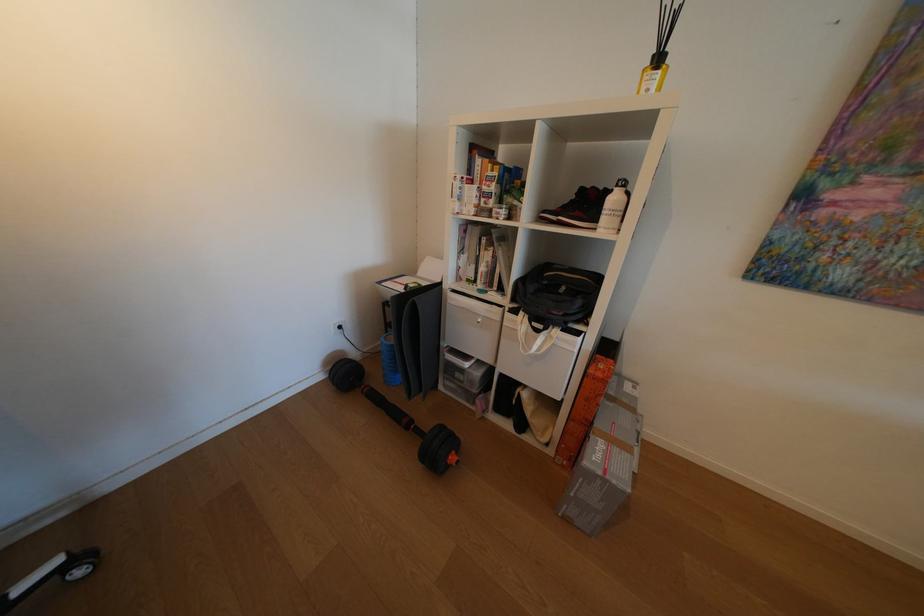
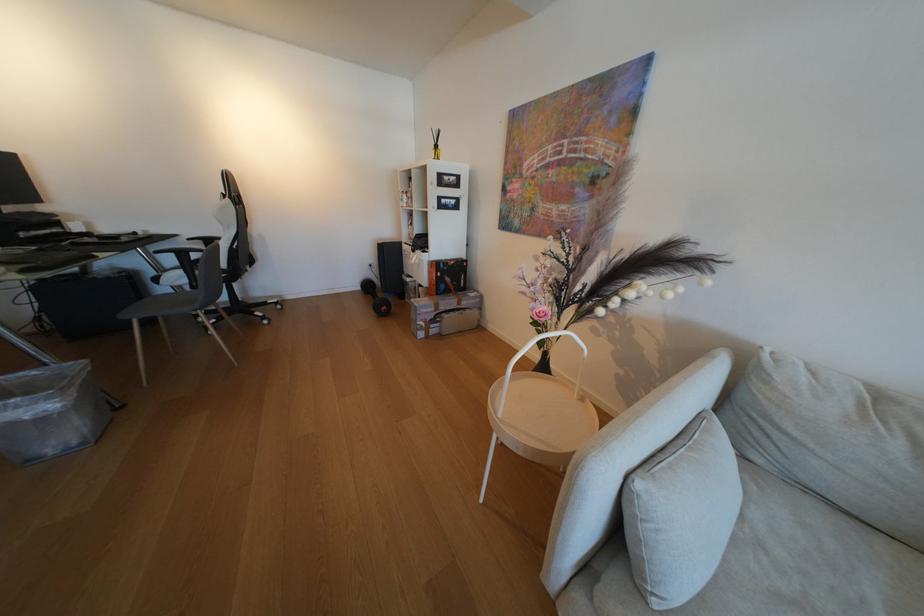
Find the pixel in the second image that matches pixel 331 379 in the first image.

(371, 290)